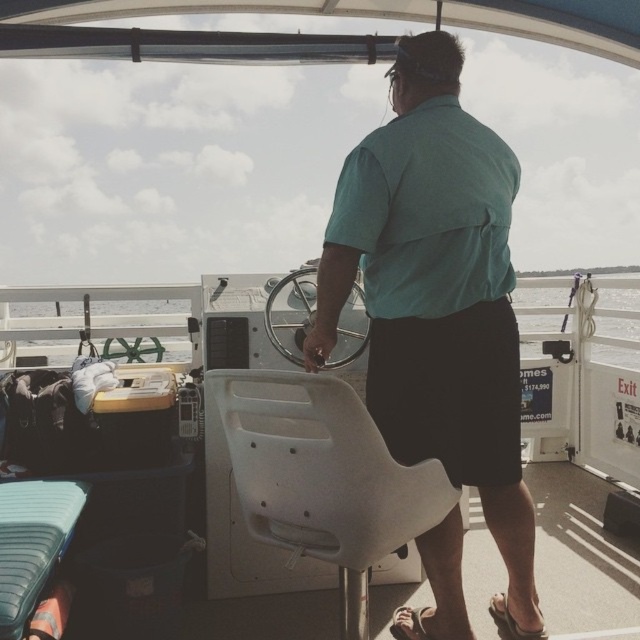
You are a passenger on the boat and need to retrieve your brown leather sandal at lower right. To reach it, you must pass through the area near the clear water at center. Is the sandal located behind or in front of the clear water?

The brown leather sandal at lower right is behind the clear water at center, so it is located behind the clear water.

You are standing on the deck of the boat and want to step into the brown leather sandal at lower right. Is the clear water at center in your way?

The clear water at center is much taller than the brown leather sandal at lower right, so the water is higher and might be in your way when stepping into the sandal.